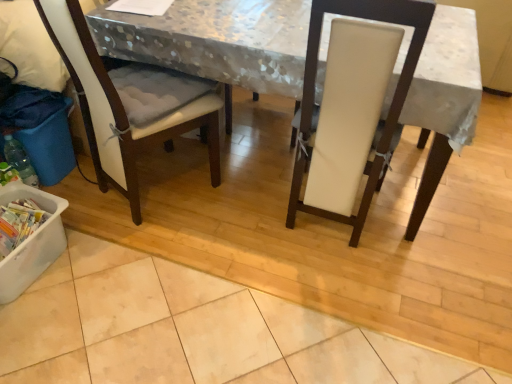
What are the coordinates of `free spot to the left of white leather chair at center, the second chair when ordered from left to right` in the screenshot? It's located at (238, 213).